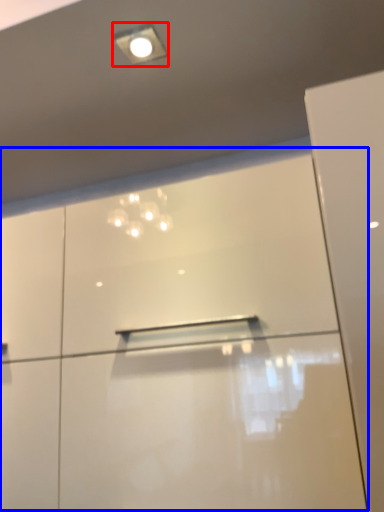
Question: Among these objects, which one is farthest to the camera, droplight (highlighted by a red box) or dresser (highlighted by a blue box)?

Choices:
 (A) droplight
 (B) dresser

Answer: (A)